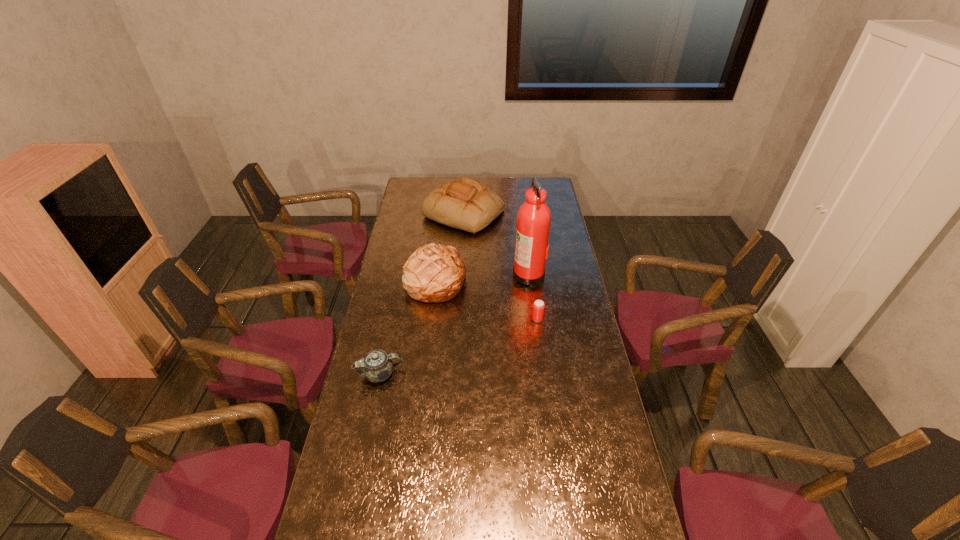
Where is `vacant area that lies between the fire extinguisher and the farther bread`? This screenshot has width=960, height=540. vacant area that lies between the fire extinguisher and the farther bread is located at coordinates (496, 244).

At what (x,y) coordinates should I click in order to perform the action: click on vacant region between the tallest object and the farther bread. Please return your answer as a coordinate pair (x, y). The width and height of the screenshot is (960, 540). Looking at the image, I should click on (496, 244).

This screenshot has width=960, height=540. I want to click on vacant space that's between the fourth farthest object and the farther bread, so click(x=500, y=266).

The width and height of the screenshot is (960, 540). In order to click on free space between the nearer bread and the chinaware in this screenshot , I will do (x=408, y=327).

Where is `free space between the second nearest object and the fire extinguisher`? The image size is (960, 540). free space between the second nearest object and the fire extinguisher is located at coordinates (533, 296).

Image resolution: width=960 pixels, height=540 pixels. I want to click on object that can be found as the third closest to the fire extinguisher, so click(434, 273).

The height and width of the screenshot is (540, 960). Identify the location of object that is the second closest one to the nearer bread. (533, 222).